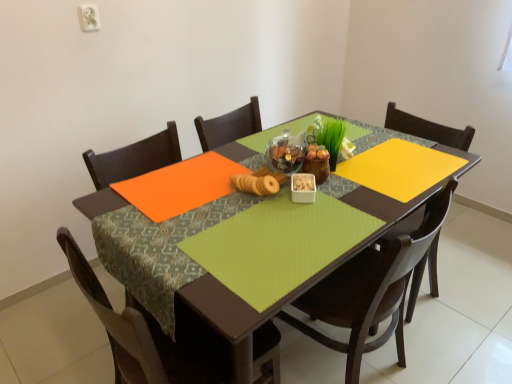
Question: Considering the relative sizes of green fabric table at center and brown wood chair at lower left, the second chair in the right-to-left sequence, in the image provided, is green fabric table at center smaller than brown wood chair at lower left, the second chair in the right-to-left sequence,?

Choices:
 (A) no
 (B) yes

Answer: (A)

Question: Can you confirm if green fabric table at center is thinner than brown wood chair at lower left, the second chair in the right-to-left sequence?

Choices:
 (A) no
 (B) yes

Answer: (A)

Question: Can you confirm if green fabric table at center is shorter than brown wood chair at lower left, the second chair in the right-to-left sequence?

Choices:
 (A) yes
 (B) no

Answer: (A)

Question: Does green fabric table at center come behind brown wood chair at lower left, the second chair in the right-to-left sequence?

Choices:
 (A) no
 (B) yes

Answer: (B)

Question: Is green fabric table at center positioned beyond the bounds of brown wood chair at lower left, which ranks as the 1th chair in left-to-right order?

Choices:
 (A) yes
 (B) no

Answer: (A)

Question: From the image's perspective, relative to matte brown cookies at center, is white plastic container at center above or below?

Choices:
 (A) below
 (B) above

Answer: (A)

Question: Based on their sizes in the image, would you say white plastic container at center is bigger or smaller than matte brown cookies at center?

Choices:
 (A) small
 (B) big

Answer: (A)

Question: Is point (310, 178) closer or farther from the camera than point (260, 173)?

Choices:
 (A) farther
 (B) closer

Answer: (B)

Question: Looking at their shapes, would you say white plastic container at center is wider or thinner than matte brown cookies at center?

Choices:
 (A) thin
 (B) wide

Answer: (A)

Question: Looking at the image, does brown wood chair at lower left, which ranks as the 1th chair in left-to-right order, seem bigger or smaller compared to matte wood chair at center, the second chair from the left?

Choices:
 (A) big
 (B) small

Answer: (B)

Question: From the image's perspective, is brown wood chair at lower left, the second chair in the right-to-left sequence, located above or below matte wood chair at center, which appears as the 1th chair when viewed from the right?

Choices:
 (A) below
 (B) above

Answer: (A)

Question: In terms of width, does brown wood chair at lower left, which ranks as the 1th chair in left-to-right order, look wider or thinner when compared to matte wood chair at center, the second chair from the left?

Choices:
 (A) wide
 (B) thin

Answer: (A)

Question: Considering their positions, is brown wood chair at lower left, the second chair in the right-to-left sequence, located in front of or behind matte wood chair at center, which appears as the 1th chair when viewed from the right?

Choices:
 (A) behind
 (B) front

Answer: (B)

Question: From the image's perspective, is brown wood chair at lower left, the second chair in the right-to-left sequence, positioned above or below white plastic container at center?

Choices:
 (A) below
 (B) above

Answer: (A)

Question: Looking at the image, does brown wood chair at lower left, the second chair in the right-to-left sequence, seem bigger or smaller compared to white plastic container at center?

Choices:
 (A) small
 (B) big

Answer: (B)